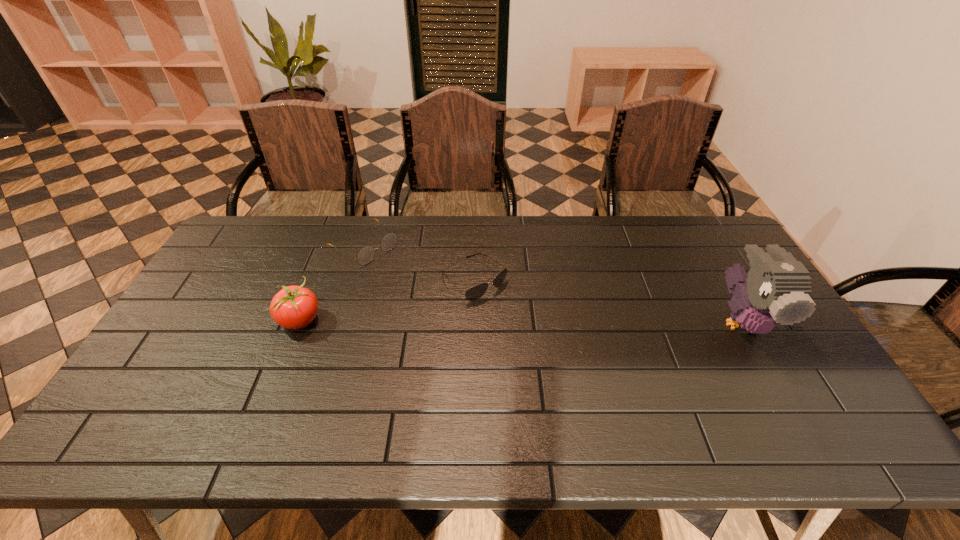
You are a GUI agent. You are given a task and a screenshot of the screen. Output one action in this format:
    pyautogui.click(x=<x>, y=<y>)
    Task: Click on the vacant space in between the tomato and the spectacles
    Image resolution: width=960 pixels, height=540 pixels.
    Given the screenshot: What is the action you would take?
    pyautogui.click(x=332, y=283)

You are a GUI agent. You are given a task and a screenshot of the screen. Output one action in this format:
    pyautogui.click(x=<x>, y=<y>)
    Task: Click on the free spot between the bird and the second tallest object
    
    Given the screenshot: What is the action you would take?
    pyautogui.click(x=521, y=321)

Find the location of a particular element. This screenshot has height=540, width=960. unoccupied position between the tomato and the sunglasses is located at coordinates (388, 300).

At what (x,y) coordinates should I click in order to perform the action: click on vacant area that lies between the spectacles and the third object from left to right. Please return your answer as a coordinate pair (x, y). The image size is (960, 540). Looking at the image, I should click on (419, 262).

Locate an element on the screen. The height and width of the screenshot is (540, 960). vacant area between the third shortest object and the bird is located at coordinates (521, 321).

Find the location of a particular element. free space between the rightmost object and the sunglasses is located at coordinates (608, 300).

Where is `free space between the spectacles and the second object from right to left`? This screenshot has height=540, width=960. free space between the spectacles and the second object from right to left is located at coordinates (419, 262).

Where is `free area in between the rightmost object and the sunglasses`? free area in between the rightmost object and the sunglasses is located at coordinates (608, 300).

At what (x,y) coordinates should I click in order to perform the action: click on free spot between the third shortest object and the bird. Please return your answer as a coordinate pair (x, y). This screenshot has width=960, height=540. Looking at the image, I should click on (521, 321).

The width and height of the screenshot is (960, 540). What are the coordinates of `free point between the second tallest object and the spectacles` in the screenshot? It's located at (332, 283).